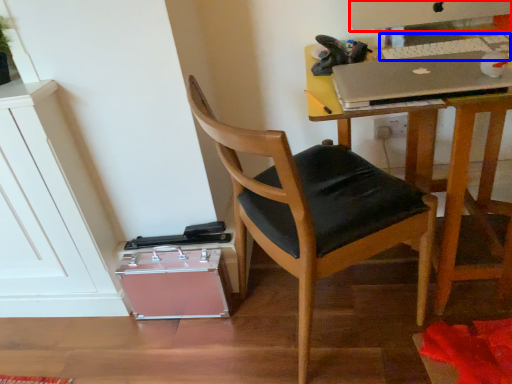
Question: Which of the following is the farthest to the observer, computer monitor (highlighted by a red box) or laptop keyboard (highlighted by a blue box)?

Choices:
 (A) computer monitor
 (B) laptop keyboard

Answer: (A)